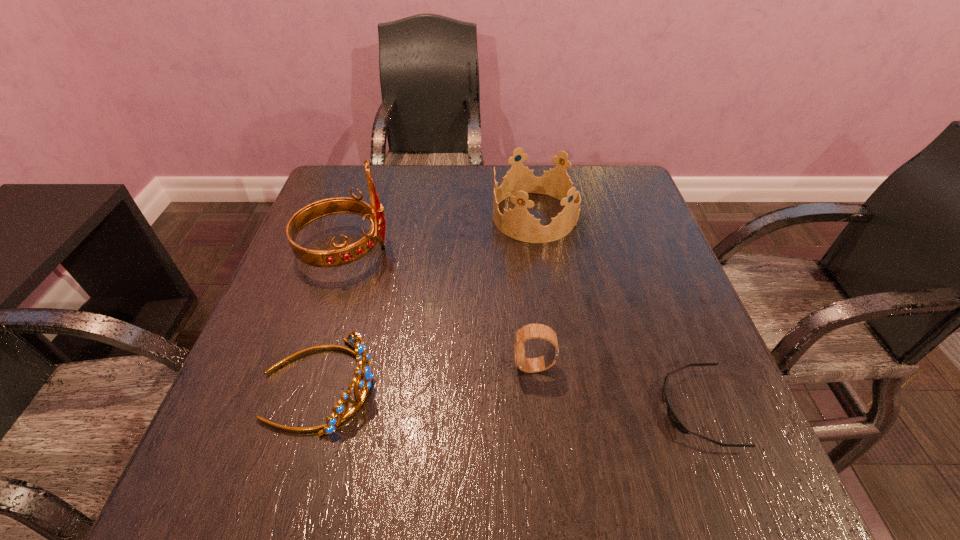
Image resolution: width=960 pixels, height=540 pixels. I want to click on object that is at the right edge, so click(x=671, y=414).

Locate an element on the screen. object at the near right corner is located at coordinates (671, 414).

In the image, there is a desktop. At what (x,y) coordinates should I click in order to perform the action: click on blank space at the far edge. Please return your answer as a coordinate pair (x, y). The height and width of the screenshot is (540, 960). Looking at the image, I should click on (452, 180).

Identify the location of vacant space at the near edge of the desktop. The image size is (960, 540). (383, 451).

You are a GUI agent. You are given a task and a screenshot of the screen. Output one action in this format:
    pyautogui.click(x=<x>, y=<y>)
    Task: Click on the vacant space at the left edge
    The image size is (960, 540).
    Given the screenshot: What is the action you would take?
    pyautogui.click(x=346, y=274)

Locate an element on the screen. The height and width of the screenshot is (540, 960). vacant space at the right edge of the desktop is located at coordinates 611,234.

The width and height of the screenshot is (960, 540). What are the coordinates of `vacant space at the far left corner of the desktop` in the screenshot? It's located at (334, 190).

In the image, there is a desktop. Identify the location of free space at the far right corner. This screenshot has height=540, width=960. tap(617, 215).

Identify the location of vacant area between the nearest tiara and the tallest object. (331, 318).

You are a GUI agent. You are given a task and a screenshot of the screen. Output one action in this format:
    pyautogui.click(x=<x>, y=<y>)
    Task: Click on the free space between the rightmost tiara and the shortest object
    The width and height of the screenshot is (960, 540).
    Given the screenshot: What is the action you would take?
    pyautogui.click(x=615, y=312)